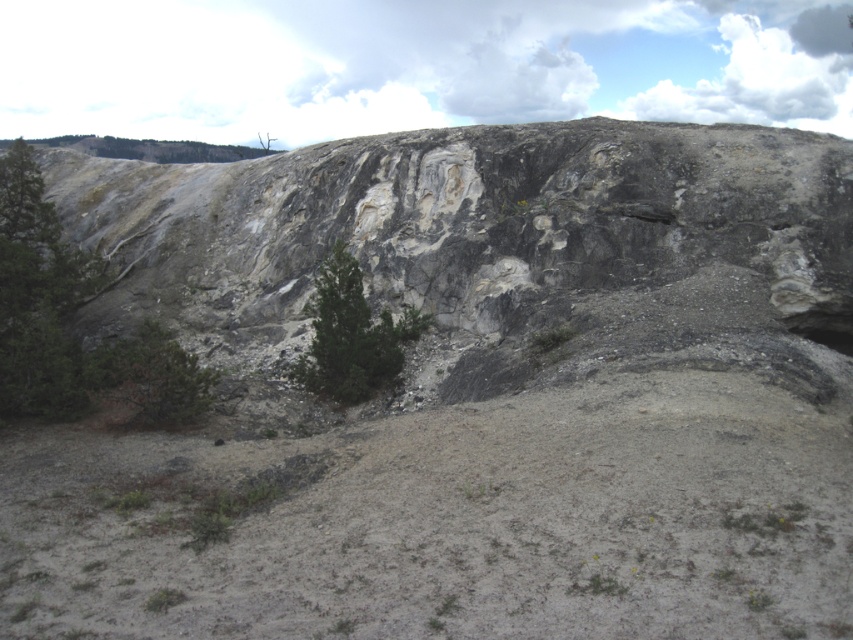
You are planning to plant a new tree in this landscape. The green matte tree at left and the green matte tree at center are already present. Which existing tree should you use as a reference for spacing if you want to plant a tree that is smaller than both?

The green matte tree at center has a smaller size, so you should use it as a reference for spacing when planting a smaller tree.

You are standing in the rugged landscape and want to walk from the green matte tree at left to the green matte tree at center. Which direction should you walk to move towards the tree that is further to the right?

You should walk towards the right because the green matte tree at center is positioned to the right of the green matte tree at left.

You are standing in front of the large rocky outcrop and want to walk towards the green matte tree at center. However, there is another green matte tree at left in your path. Which tree will you encounter first?

The green matte tree at left will be encountered first since it is positioned in front of the green matte tree at center from your viewpoint.